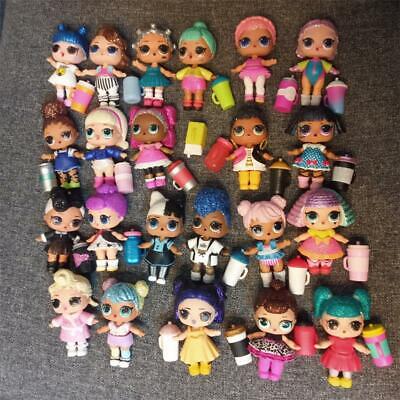
Identify the location of toy figures in first column from the left and also first column from the right. The height and width of the screenshot is (400, 400). (60, 66), (61, 148), (64, 228), (65, 308), (344, 322), (326, 226), (318, 138), (316, 63).